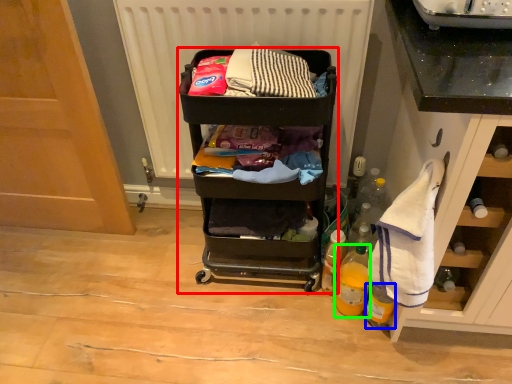
Question: Considering the real-world distances, which object is closest to furniture (highlighted by a red box)? bottle (highlighted by a blue box) or bottle (highlighted by a green box).

Choices:
 (A) bottle
 (B) bottle

Answer: (B)